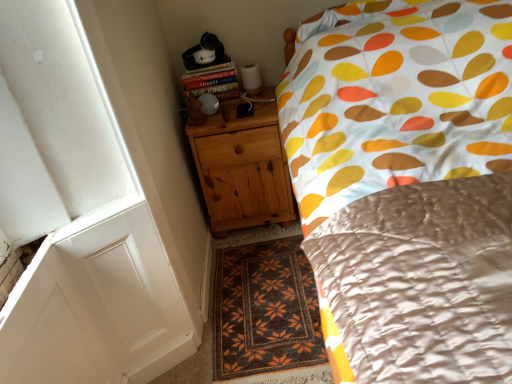
Question: From a real-world perspective, is natural wood chest of drawers at lower left under brown woven rug at center?

Choices:
 (A) no
 (B) yes

Answer: (A)

Question: Can you confirm if natural wood chest of drawers at lower left is wider than brown woven rug at center?

Choices:
 (A) yes
 (B) no

Answer: (B)

Question: Is natural wood chest of drawers at lower left outside brown woven rug at center?

Choices:
 (A) yes
 (B) no

Answer: (A)

Question: Is natural wood chest of drawers at lower left to the left of brown woven rug at center from the viewer's perspective?

Choices:
 (A) no
 (B) yes

Answer: (B)

Question: Considering the relative positions of natural wood chest of drawers at lower left and brown woven rug at center in the image provided, is natural wood chest of drawers at lower left in front of brown woven rug at center?

Choices:
 (A) no
 (B) yes

Answer: (A)

Question: Considering the positions of brown woven rug at center and hardcover book at upper left in the image, is brown woven rug at center taller or shorter than hardcover book at upper left?

Choices:
 (A) short
 (B) tall

Answer: (A)

Question: Considering their positions, is brown woven rug at center located in front of or behind hardcover book at upper left?

Choices:
 (A) front
 (B) behind

Answer: (A)

Question: In terms of width, does brown woven rug at center look wider or thinner when compared to hardcover book at upper left?

Choices:
 (A) wide
 (B) thin

Answer: (A)

Question: Considering the positions of point (232, 276) and point (219, 86), is point (232, 276) closer or farther from the camera than point (219, 86)?

Choices:
 (A) closer
 (B) farther

Answer: (A)

Question: Is point (229, 370) closer or farther from the camera than point (242, 188)?

Choices:
 (A) closer
 (B) farther

Answer: (A)

Question: Based on their sizes in the image, would you say brown woven rug at center is bigger or smaller than natural wood chest of drawers at lower left?

Choices:
 (A) small
 (B) big

Answer: (A)

Question: Considering the positions of brown woven rug at center and natural wood chest of drawers at lower left in the image, is brown woven rug at center wider or thinner than natural wood chest of drawers at lower left?

Choices:
 (A) thin
 (B) wide

Answer: (B)

Question: Is brown woven rug at center inside the boundaries of natural wood chest of drawers at lower left, or outside?

Choices:
 (A) inside
 (B) outside

Answer: (B)

Question: Based on their positions, is natural wood chest of drawers at lower left located to the left or right of hardcover book at upper left?

Choices:
 (A) right
 (B) left

Answer: (A)

Question: From a real-world perspective, is natural wood chest of drawers at lower left above or below hardcover book at upper left?

Choices:
 (A) above
 (B) below

Answer: (B)